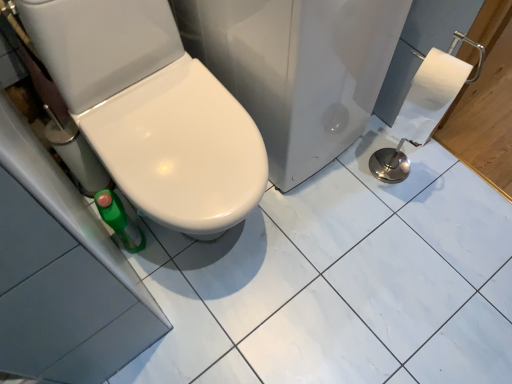
Question: Is white glossy toilet at lower left in front of or behind white glossy toilet seat at center in the image?

Choices:
 (A) behind
 (B) front

Answer: (B)

Question: Does point pos(195,135) appear closer or farther from the camera than point pos(326,84)?

Choices:
 (A) farther
 (B) closer

Answer: (B)

Question: From the image's perspective, is white glossy toilet at lower left positioned above or below white glossy toilet seat at center?

Choices:
 (A) below
 (B) above

Answer: (A)

Question: Would you say white glossy toilet seat at center is to the left or to the right of white glossy toilet at lower left in the picture?

Choices:
 (A) left
 (B) right

Answer: (B)

Question: In terms of size, does white glossy toilet seat at center appear bigger or smaller than white glossy toilet at lower left?

Choices:
 (A) small
 (B) big

Answer: (B)

Question: Considering the positions of white glossy toilet seat at center and white glossy toilet at lower left in the image, is white glossy toilet seat at center wider or thinner than white glossy toilet at lower left?

Choices:
 (A) thin
 (B) wide

Answer: (B)

Question: Is white glossy toilet seat at center in front of or behind white glossy toilet at lower left in the image?

Choices:
 (A) behind
 (B) front

Answer: (A)